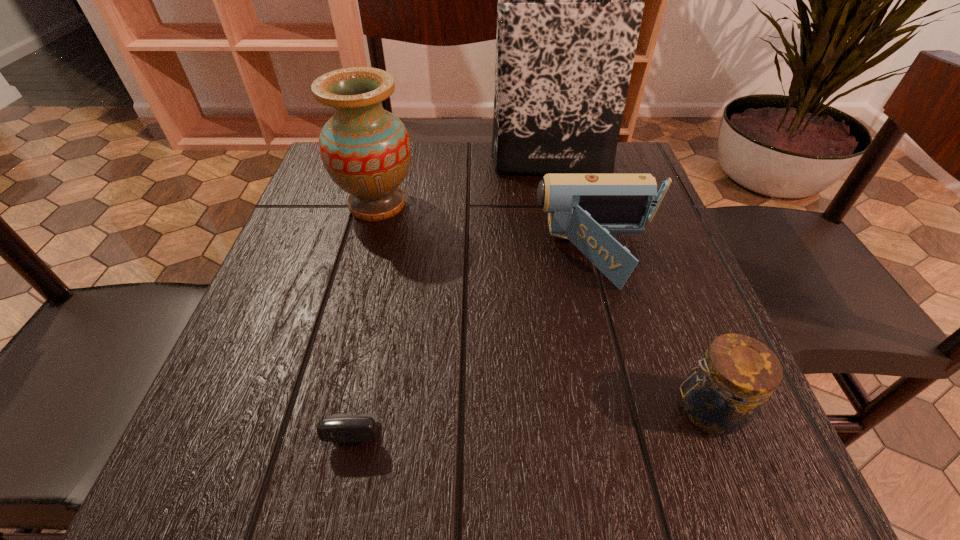
Where is `free space between the jar and the shopping bag`? The height and width of the screenshot is (540, 960). free space between the jar and the shopping bag is located at coordinates (628, 286).

The image size is (960, 540). I want to click on free space between the jar and the vase, so click(x=542, y=306).

Select which object appears as the second closest to the camcorder. Please provide its 2D coordinates. Your answer should be formatted as a tuple, i.e. [(x, y)], where the tuple contains the x and y coordinates of a point satisfying the conditions above.

[(569, 11)]

At what (x,y) coordinates should I click in order to perform the action: click on object that can be found as the fourth closest to the shopping bag. Please return your answer as a coordinate pair (x, y). This screenshot has height=540, width=960. Looking at the image, I should click on (725, 390).